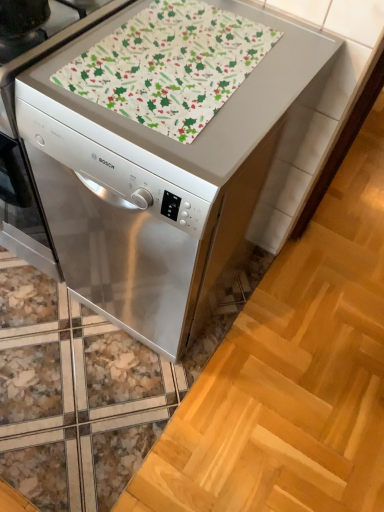
This screenshot has width=384, height=512. Identify the location of satin silver dishwasher at center. (160, 182).

What do you see at coordinates (160, 182) in the screenshot?
I see `satin silver dishwasher at center` at bounding box center [160, 182].

Where is `patterned fabric at center`? The height and width of the screenshot is (512, 384). patterned fabric at center is located at coordinates (170, 65).

Image resolution: width=384 pixels, height=512 pixels. What do you see at coordinates (170, 65) in the screenshot? I see `patterned fabric at center` at bounding box center [170, 65].

Where is `satin silver dishwasher at center`? This screenshot has height=512, width=384. satin silver dishwasher at center is located at coordinates (160, 182).

Consider the image. Is satin silver dishwasher at center at the right side of patterned fabric at center?

In fact, satin silver dishwasher at center is to the left of patterned fabric at center.

Based on the photo, is satin silver dishwasher at center in front of or behind patterned fabric at center in the image?

Visually, satin silver dishwasher at center is located in front of patterned fabric at center.

Is point (183, 263) behind point (187, 84)?

Yes, point (183, 263) is farther from viewer.

From the image's perspective, which is below, satin silver dishwasher at center or patterned fabric at center?

From the image's view, satin silver dishwasher at center is below.

From a real-world perspective, relative to patterned fabric at center, is satin silver dishwasher at center vertically above or below?

satin silver dishwasher at center is situated lower than patterned fabric at center in the real world.

Considering the relative sizes of satin silver dishwasher at center and patterned fabric at center in the image provided, is satin silver dishwasher at center wider than patterned fabric at center?

Indeed, satin silver dishwasher at center has a greater width compared to patterned fabric at center.

Who is shorter, satin silver dishwasher at center or patterned fabric at center?

patterned fabric at center is shorter.

Is satin silver dishwasher at center smaller than patterned fabric at center?

No, satin silver dishwasher at center is not smaller than patterned fabric at center.

Is satin silver dishwasher at center spatially inside patterned fabric at center, or outside of it?

satin silver dishwasher at center lies outside patterned fabric at center.

In the scene shown: Is satin silver dishwasher at center placed right next to patterned fabric at center?

No, satin silver dishwasher at center is not with patterned fabric at center.

Is satin silver dishwasher at center positioned with its back to patterned fabric at center?

No, satin silver dishwasher at center is not facing away from patterned fabric at center.

Can you tell me how much satin silver dishwasher at center and patterned fabric at center differ in facing direction?

The angular difference between satin silver dishwasher at center and patterned fabric at center is 3.57 degrees.

How much distance is there between satin silver dishwasher at center and patterned fabric at center?

The distance of satin silver dishwasher at center from patterned fabric at center is 8.02 inches.

Identify the location of home appliance in front of the patterned fabric at center. (160, 182).

In the scene shown: Considering the relative positions of patterned fabric at center and satin silver dishwasher at center in the image provided, is patterned fabric at center to the left or to the right of satin silver dishwasher at center?

In the image, patterned fabric at center appears on the right side of satin silver dishwasher at center.

Which object is closer to the camera taking this photo, patterned fabric at center or satin silver dishwasher at center?

satin silver dishwasher at center is closer to the camera.

Does point (147, 94) lie behind point (164, 218)?

No, (147, 94) is closer to viewer.

From the image's perspective, which is above, patterned fabric at center or satin silver dishwasher at center?

patterned fabric at center, from the image's perspective.

From a real-world perspective, between patterned fabric at center and satin silver dishwasher at center, who is vertically higher?

In real-world perspective, patterned fabric at center is above.

Which of these two, patterned fabric at center or satin silver dishwasher at center, is wider?

Wider between the two is satin silver dishwasher at center.

From their relative heights in the image, would you say patterned fabric at center is taller or shorter than satin silver dishwasher at center?

patterned fabric at center is shorter than satin silver dishwasher at center.

Is patterned fabric at center bigger or smaller than satin silver dishwasher at center?

Considering their sizes, patterned fabric at center takes up less space than satin silver dishwasher at center.

Based on the photo, is patterned fabric at center inside or outside of satin silver dishwasher at center?

patterned fabric at center fits inside satin silver dishwasher at center.

Looking at this image, is patterned fabric at center positioned far away from satin silver dishwasher at center?

patterned fabric at center is near satin silver dishwasher at center, not far away.

Looking at this image, does patterned fabric at center turn towards satin silver dishwasher at center?

Yes, patterned fabric at center is turned towards satin silver dishwasher at center.

Where is `blanket above the satin silver dishwasher at center (from the image's perspective)`? The image size is (384, 512). blanket above the satin silver dishwasher at center (from the image's perspective) is located at coordinates (170, 65).

Where is `blanket that appears on the right of satin silver dishwasher at center`? The image size is (384, 512). blanket that appears on the right of satin silver dishwasher at center is located at coordinates (170, 65).

Identify the location of home appliance in front of the patterned fabric at center. Image resolution: width=384 pixels, height=512 pixels. (160, 182).